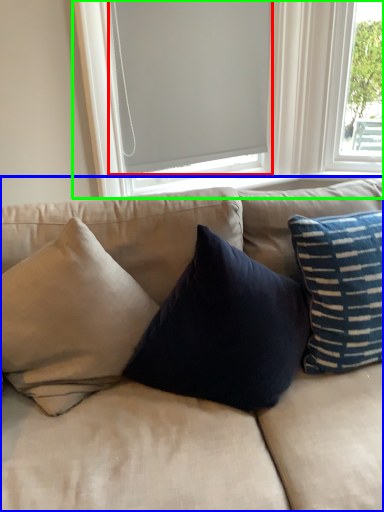
Question: Which object is positioned farthest from window screen (highlighted by a red box)? Select from studio couch (highlighted by a blue box) and window (highlighted by a green box).

Choices:
 (A) studio couch
 (B) window

Answer: (A)